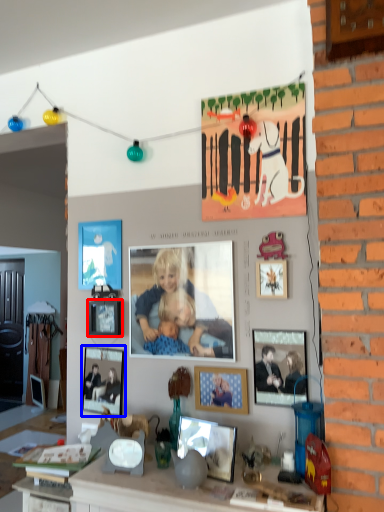
Question: Which object is further to the camera taking this photo, picture frame (highlighted by a red box) or picture frame (highlighted by a blue box)?

Choices:
 (A) picture frame
 (B) picture frame

Answer: (B)